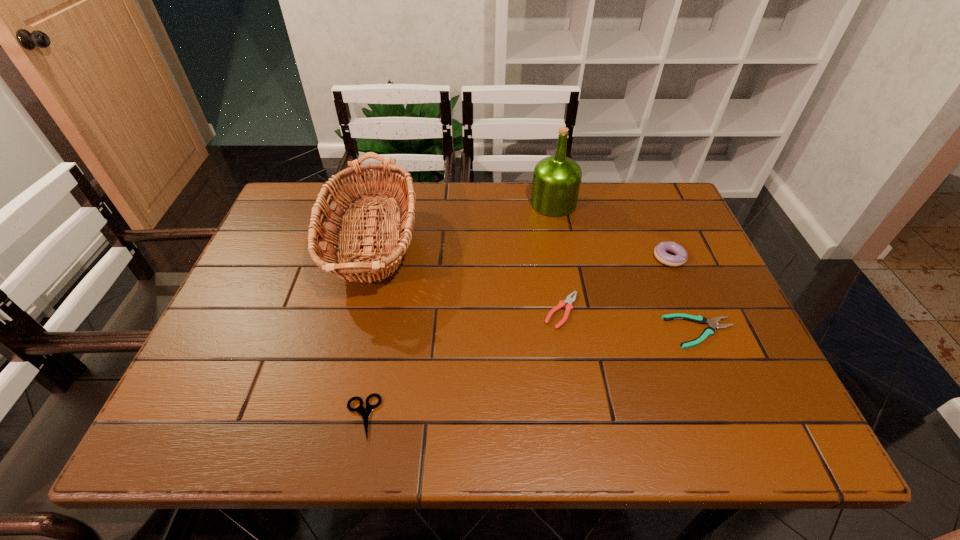
Where is `free space between the basket and the left pliers`? free space between the basket and the left pliers is located at coordinates (468, 277).

In order to click on vacant space that is in between the shorter pliers and the fourth shortest object in this screenshot , I will do `click(684, 295)`.

Image resolution: width=960 pixels, height=540 pixels. Identify the location of vacant space in between the fifth shortest object and the fourth shortest object. (521, 251).

Image resolution: width=960 pixels, height=540 pixels. Identify the location of vacant area between the left pliers and the nearest object. (462, 364).

You are a GUI agent. You are given a task and a screenshot of the screen. Output one action in this format:
    pyautogui.click(x=<x>, y=<y>)
    Task: Click on the object that is the fifth closest to the third tallest object
    The width and height of the screenshot is (960, 540).
    Given the screenshot: What is the action you would take?
    pyautogui.click(x=364, y=412)

Point out which object is positioned as the nearest to the doughnut. Please provide its 2D coordinates. Your answer should be formatted as a tuple, i.e. [(x, y)], where the tuple contains the x and y coordinates of a point satisfying the conditions above.

[(712, 323)]

Where is `vacant space that satisfies the following two spatial constraints: 1. on the back side of the doughnut; 2. on the right side of the shears`? vacant space that satisfies the following two spatial constraints: 1. on the back side of the doughnut; 2. on the right side of the shears is located at coordinates (394, 258).

Where is `vacant position in the image that satisfies the following two spatial constraints: 1. on the back side of the nearest object; 2. on the left side of the right pliers`? This screenshot has width=960, height=540. vacant position in the image that satisfies the following two spatial constraints: 1. on the back side of the nearest object; 2. on the left side of the right pliers is located at coordinates (379, 332).